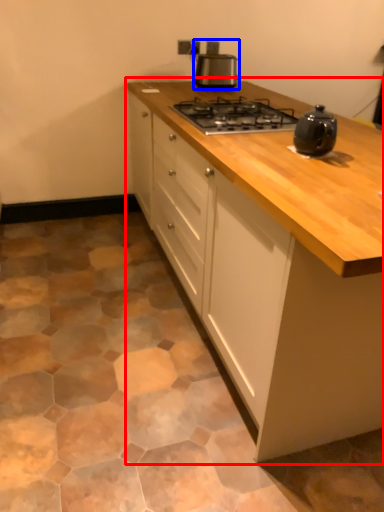
Question: Which of the following is the farthest to the observer, cabinetry (highlighted by a red box) or kitchen appliance (highlighted by a blue box)?

Choices:
 (A) cabinetry
 (B) kitchen appliance

Answer: (B)